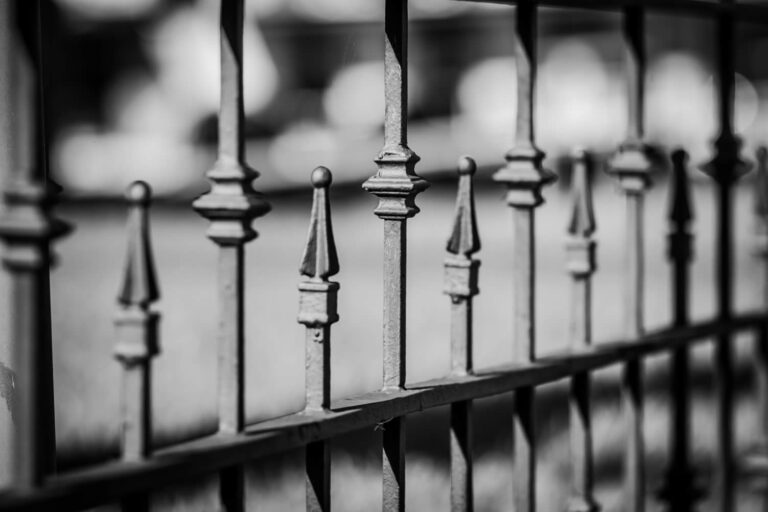
What are the coordinates of `rod` in the screenshot? It's located at (521, 344).